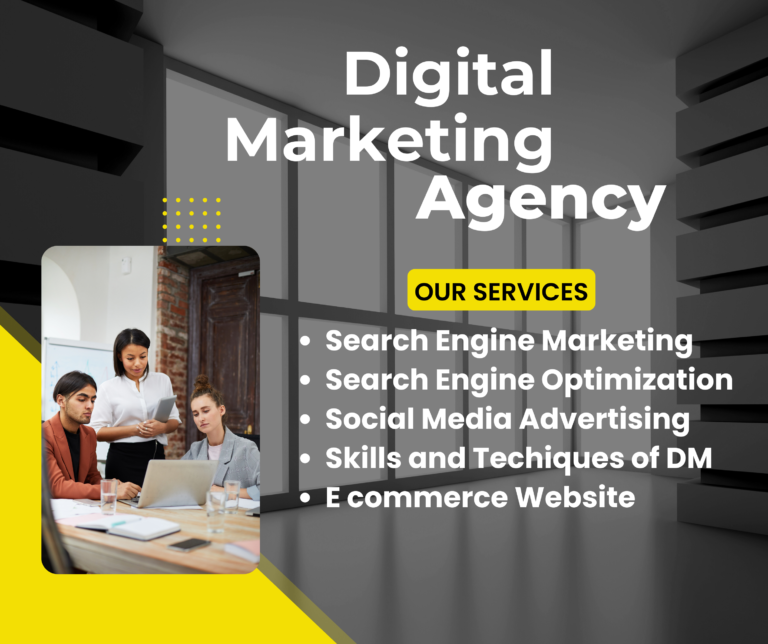
Locate an element on the screen. gray ceiling is located at coordinates (247, 33).